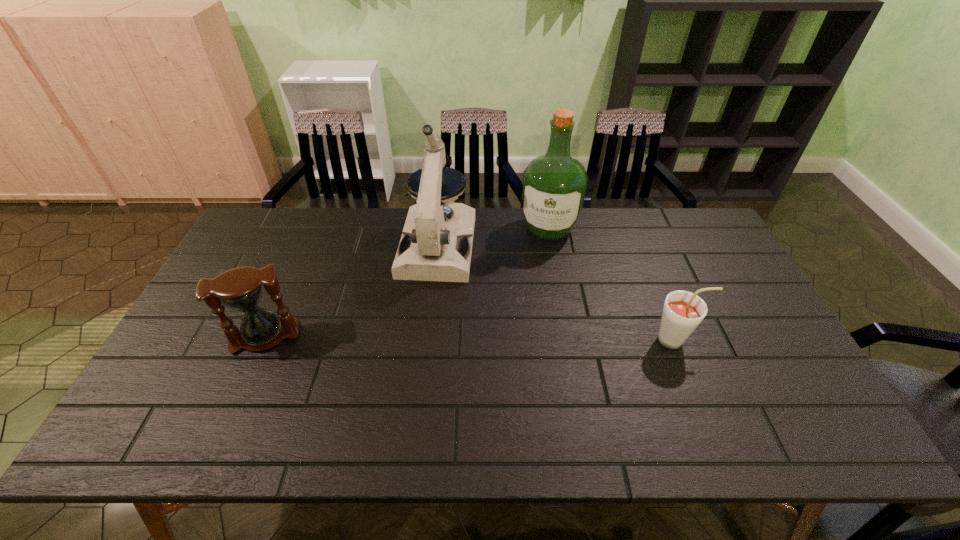
Where is `free space between the second object from left to right and the rightmost object`? This screenshot has width=960, height=540. free space between the second object from left to right and the rightmost object is located at coordinates (557, 293).

You are a GUI agent. You are given a task and a screenshot of the screen. Output one action in this format:
    pyautogui.click(x=<x>, y=<y>)
    Task: Click on the object that can be found as the second closest to the microscope
    
    Given the screenshot: What is the action you would take?
    pyautogui.click(x=241, y=288)

Image resolution: width=960 pixels, height=540 pixels. I want to click on object that is the closest to the third object from left to right, so click(430, 249).

Find the location of a particular element. vacant position in the image that satisfies the following two spatial constraints: 1. on the front side of the microscope; 2. on the drink side of the root beer is located at coordinates (427, 340).

In order to click on vacant area in the image that satisfies the following two spatial constraints: 1. on the front side of the second object from left to right; 2. on the drink side of the root beer in this screenshot , I will do `click(427, 340)`.

This screenshot has width=960, height=540. In order to click on free space that satisfies the following two spatial constraints: 1. on the back side of the second object from left to right; 2. on the right side of the third object from left to right in this screenshot , I will do `click(440, 229)`.

The height and width of the screenshot is (540, 960). Find the location of `vacant area that satisfies the following two spatial constraints: 1. on the back side of the liquor; 2. on the right side of the microscope`. vacant area that satisfies the following two spatial constraints: 1. on the back side of the liquor; 2. on the right side of the microscope is located at coordinates (440, 229).

Find the location of a particular element. blank space that satisfies the following two spatial constraints: 1. on the front side of the second object from right to left; 2. on the drink side of the root beer is located at coordinates (568, 340).